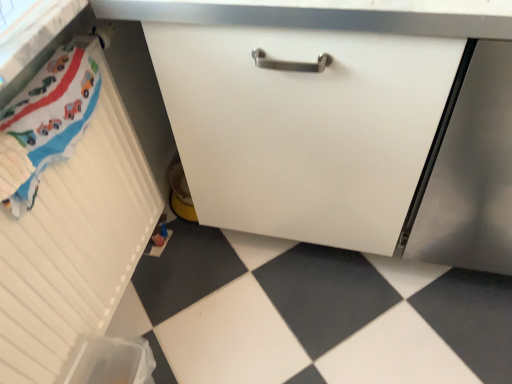
Question: Is the position of satin silver screen door at lower right less distant than that of white matte radiator at left, the second cabinetry when ordered from right to left?

Choices:
 (A) no
 (B) yes

Answer: (A)

Question: From the image's perspective, is satin silver screen door at lower right above white matte radiator at left, the second cabinetry when ordered from right to left?

Choices:
 (A) no
 (B) yes

Answer: (B)

Question: Are satin silver screen door at lower right and white matte radiator at left, which is the first cabinetry from left to right, making contact?

Choices:
 (A) no
 (B) yes

Answer: (A)

Question: Can you confirm if satin silver screen door at lower right is shorter than white matte radiator at left, which is the first cabinetry from left to right?

Choices:
 (A) yes
 (B) no

Answer: (B)

Question: Is satin silver screen door at lower right at the right side of white matte radiator at left, which is the first cabinetry from left to right?

Choices:
 (A) no
 (B) yes

Answer: (B)

Question: Does satin silver screen door at lower right have a lesser width compared to white matte radiator at left, the second cabinetry when ordered from right to left?

Choices:
 (A) yes
 (B) no

Answer: (B)

Question: Is white matte radiator at left, which is the first cabinetry from left to right, positioned in front of white matte cabinet at center, which appears as the 2th cabinetry when viewed from the left?

Choices:
 (A) yes
 (B) no

Answer: (A)

Question: Is white matte radiator at left, the second cabinetry when ordered from right to left, positioned behind white matte cabinet at center, which ranks as the 1th cabinetry in right-to-left order?

Choices:
 (A) no
 (B) yes

Answer: (A)

Question: From the image's perspective, is white matte radiator at left, which is the first cabinetry from left to right, over white matte cabinet at center, which appears as the 2th cabinetry when viewed from the left?

Choices:
 (A) no
 (B) yes

Answer: (A)

Question: Considering the relative sizes of white matte radiator at left, which is the first cabinetry from left to right, and white matte cabinet at center, which appears as the 2th cabinetry when viewed from the left, in the image provided, is white matte radiator at left, which is the first cabinetry from left to right, shorter than white matte cabinet at center, which appears as the 2th cabinetry when viewed from the left,?

Choices:
 (A) no
 (B) yes

Answer: (B)

Question: From the image's perspective, is white matte radiator at left, which is the first cabinetry from left to right, below white matte cabinet at center, which appears as the 2th cabinetry when viewed from the left?

Choices:
 (A) yes
 (B) no

Answer: (A)

Question: Is white matte radiator at left, which is the first cabinetry from left to right, positioned with its back to white matte cabinet at center, which ranks as the 1th cabinetry in right-to-left order?

Choices:
 (A) no
 (B) yes

Answer: (A)

Question: From the image's perspective, is white matte radiator at left, which is the first cabinetry from left to right, located beneath satin silver screen door at lower right?

Choices:
 (A) yes
 (B) no

Answer: (A)